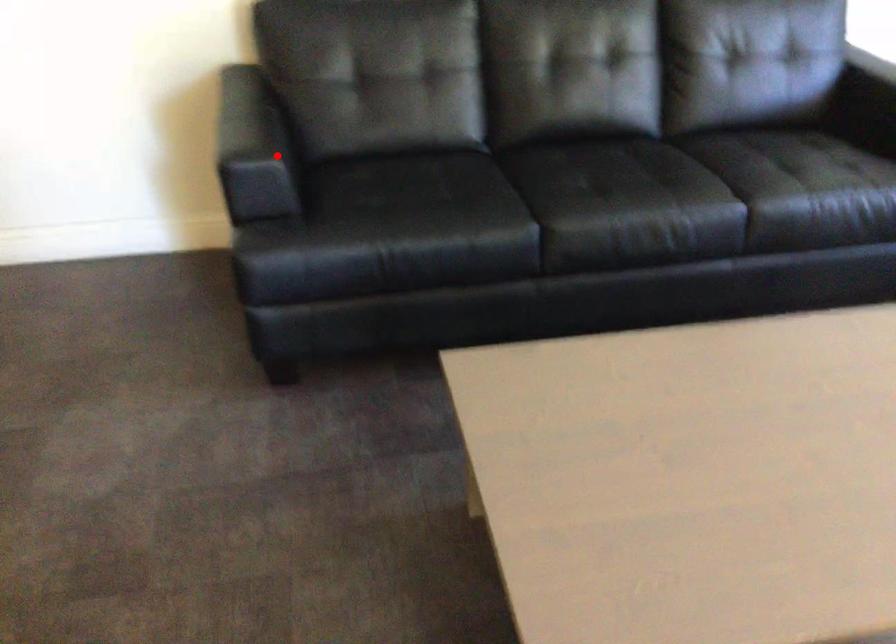
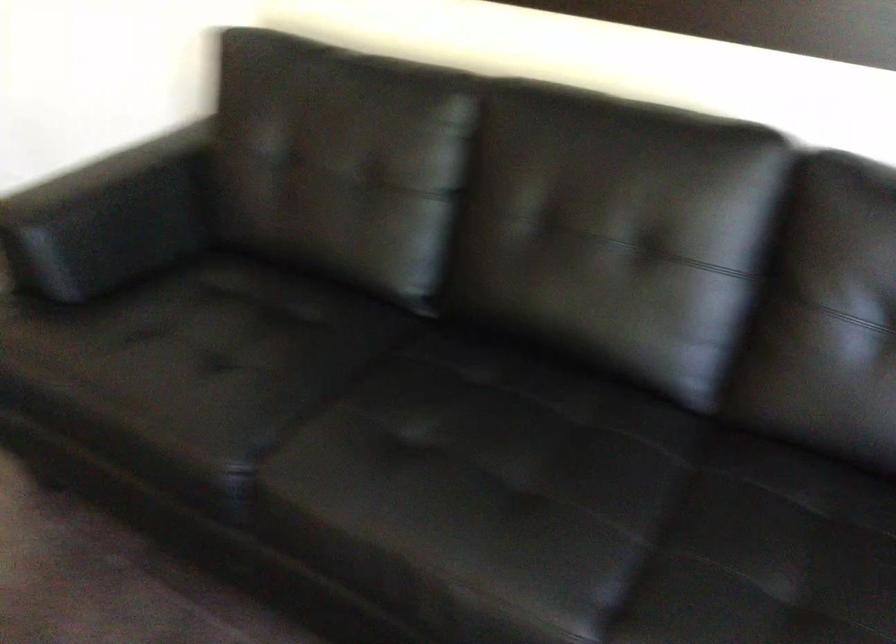
Locate, in the second image, the point that corresponds to the highlighted location in the first image.

(108, 218)